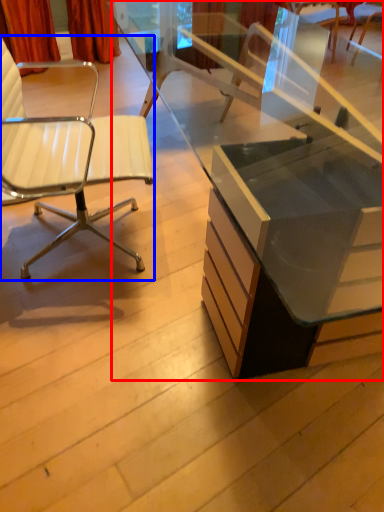
Question: Which point is further to the camera, desk (highlighted by a red box) or chair (highlighted by a blue box)?

Choices:
 (A) desk
 (B) chair

Answer: (B)